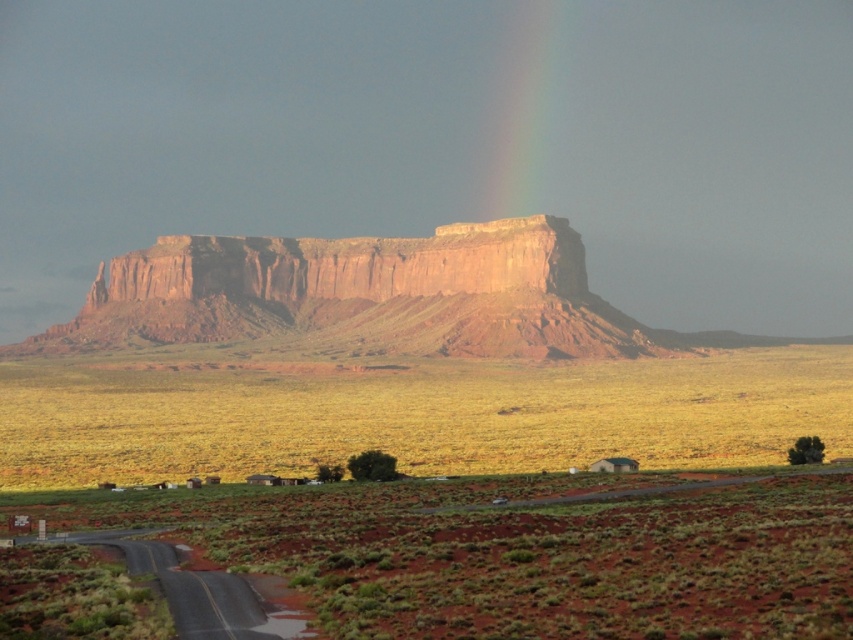
You are a photographer planning to capture the rustic sandstone mesa at center and the rainbow translucent at upper center in the same frame. Based on their positions, which object should you focus on first to ensure both are in focus?

The rustic sandstone mesa at center is below the rainbow translucent at upper center, so focusing on the rustic sandstone mesa at center first will help ensure both are in focus since it is closer to the camera.